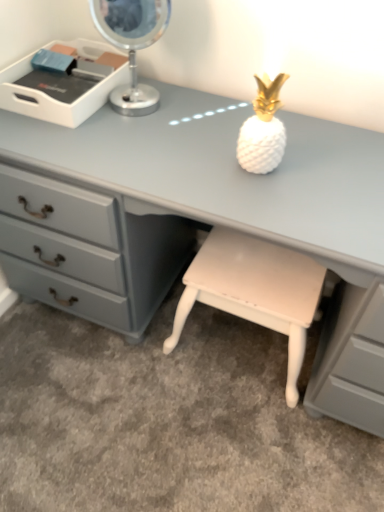
Locate an element on the screen. The image size is (384, 512). free space in front of metallic silver table lamp at upper left is located at coordinates (127, 139).